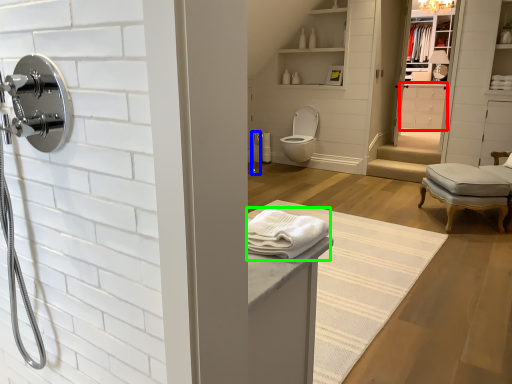
Question: Considering the real-world distances, which object is closest to cabinetry (highlighted by a red box)? shower (highlighted by a blue box) or bath towel (highlighted by a green box).

Choices:
 (A) shower
 (B) bath towel

Answer: (A)